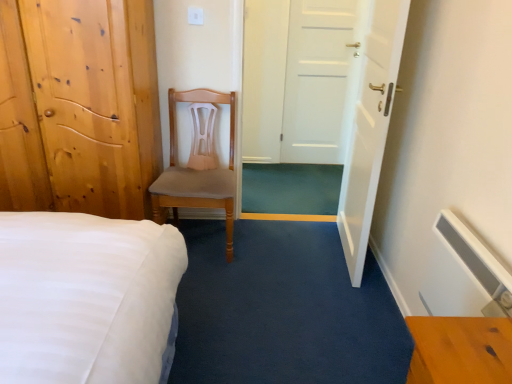
Question: Is white glossy door at center, the 3th door viewed from the left, to the left or to the right of light brown wooden door at left, which is the first door from left to right, in the image?

Choices:
 (A) right
 (B) left

Answer: (A)

Question: From a real-world perspective, is white glossy door at center, the 3th door viewed from the left, physically located above or below light brown wooden door at left, which is the first door from left to right?

Choices:
 (A) above
 (B) below

Answer: (A)

Question: Considering the real-world distances, which object is closest to the white matte door at center, arranged as the 2th door when viewed from the left?

Choices:
 (A) light brown wood chair at center
 (B) white glossy door at center, placed as the first door when sorted from right to left
 (C) light brown wooden door at left, the third door positioned from the right

Answer: (B)

Question: Considering the real-world distances, which object is closest to the white glossy door at center, placed as the first door when sorted from right to left?

Choices:
 (A) white matte door at center, arranged as the 2th door when viewed from the left
 (B) light brown wooden door at left, the third door positioned from the right
 (C) light brown wood chair at center

Answer: (C)